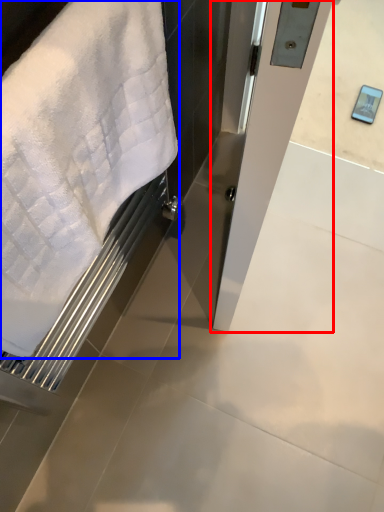
Question: Which of the following is the closest to the observer, screen door (highlighted by a red box) or towel (highlighted by a blue box)?

Choices:
 (A) screen door
 (B) towel

Answer: (B)